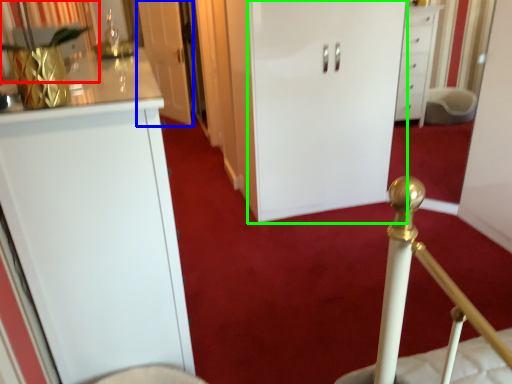
Question: Based on their relative distances, which object is nearer to curtain (highlighted by a red box)? Choose from door (highlighted by a blue box) and door (highlighted by a green box).

Choices:
 (A) door
 (B) door

Answer: (B)